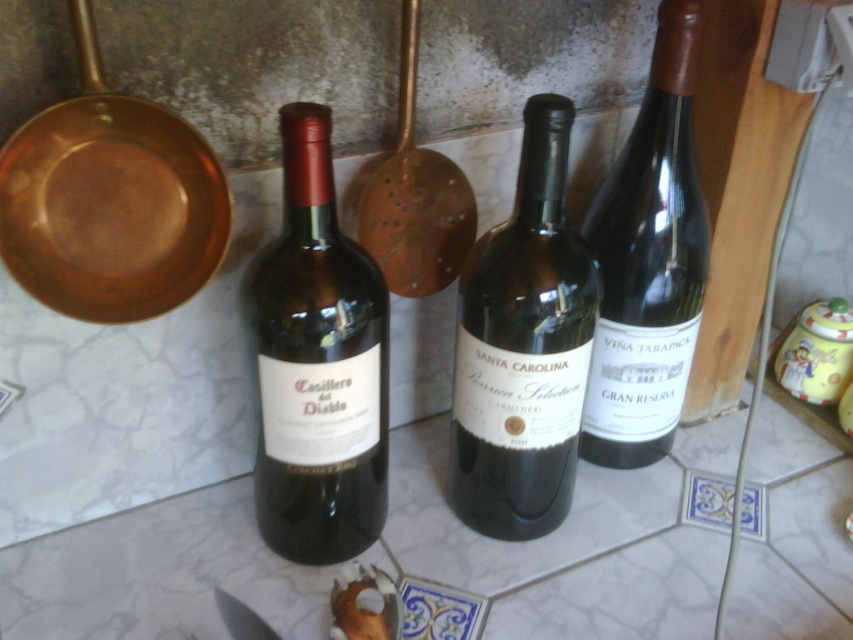
Question: Is matte dark brown bottle at center to the right of matte silver knife at lower left from the viewer's perspective?

Choices:
 (A) no
 (B) yes

Answer: (B)

Question: Is dark brown glass bottle at center closer to the viewer compared to matte silver knife at lower left?

Choices:
 (A) no
 (B) yes

Answer: (A)

Question: Which point is closer to the camera taking this photo?

Choices:
 (A) (555, 504)
 (B) (618, 289)

Answer: (B)

Question: Which object is closer to the camera taking this photo?

Choices:
 (A) matte dark brown bottle at center
 (B) dark green glass bottle at center
 (C) dark brown glass bottle at center
 (D) matte silver knife at lower left

Answer: (A)

Question: Which point is closer to the camera?

Choices:
 (A) (297, 280)
 (B) (461, 500)
 (C) (225, 620)

Answer: (A)

Question: Observing the image, what is the correct spatial positioning of dark brown glass bottle at center in reference to matte silver knife at lower left?

Choices:
 (A) right
 (B) left

Answer: (A)